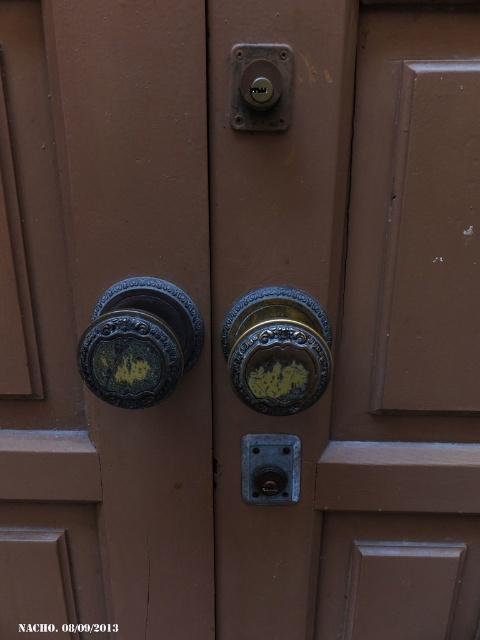
You are trying to open the door and notice the gold ornate door handle at center and the matte brass lock at upper center. Which object would you interact with first to unlock the door?

You should interact with the matte brass lock at upper center first because the gold ornate door handle at center is in front of it, meaning the lock is behind and needs to be accessed before turning the handle.

You are a delivery person trying to deliver a package to a house with this door. You need to ring the doorbell but accidentally hit the gold ornate door handle at center instead. How far did you miss the matte brass doorbell at center by?

The gold ornate door handle at center is 11.20 inches away from the matte brass doorbell at center, so you missed the matte brass doorbell at center by 11.20 inches.

You are standing in front of the door and want to press the matte brass doorbell at center. Which direction should you move your hand from the matte brass lock at upper center to reach it?

The matte brass lock at upper center is located below the matte brass doorbell at center, so you should move your hand upward to reach the matte brass doorbell at center.